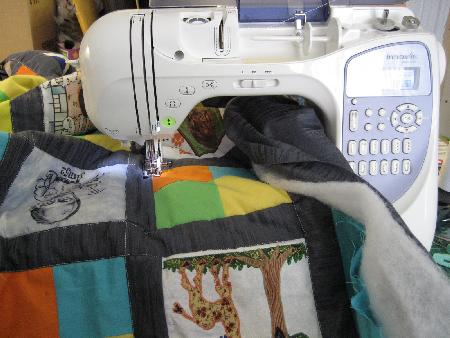
Where is `wall`? wall is located at coordinates (20, 10).